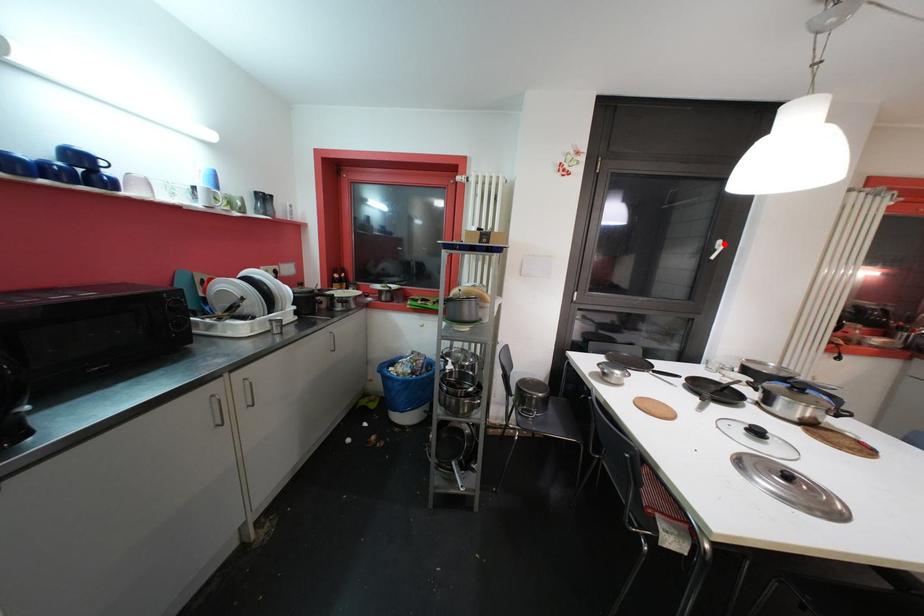
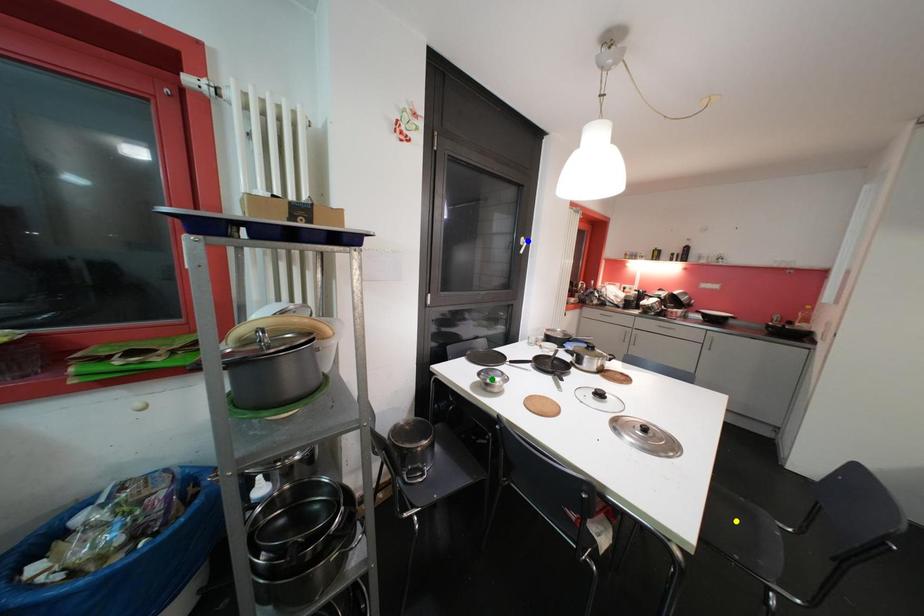
Question: I am providing you with two images of the same scene from different viewpoints. A red point is marked on the first image. You are given multiple points on the second image. Which spot in image 2 lines up with the point in image 1?

Choices:
 (A) yellow point
 (B) green point
 (C) blue point

Answer: (C)